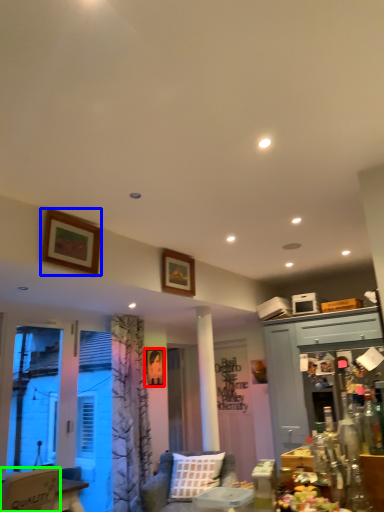
Question: Estimate the real-world distances between objects in this image. Which object is closer to picture frame (highlighted by a red box), picture frame (highlighted by a blue box) or chair (highlighted by a green box)?

Choices:
 (A) picture frame
 (B) chair

Answer: (A)